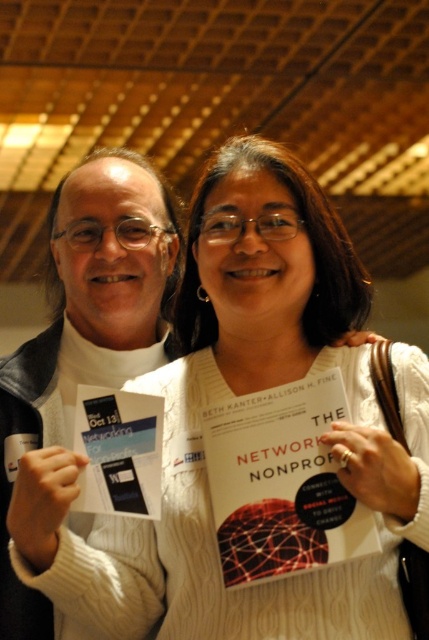
Question: Which point appears farthest from the camera in this image?

Choices:
 (A) (247, 540)
 (B) (154, 413)

Answer: (B)

Question: Does white sweater at left appear on the right side of white paper book at center?

Choices:
 (A) no
 (B) yes

Answer: (A)

Question: Among these points, which one is farthest from the camera?

Choices:
 (A) (102, 406)
 (B) (68, 253)
 (C) (337, 506)

Answer: (B)

Question: Can you confirm if white sweater at left is positioned to the right of white paper book at center?

Choices:
 (A) no
 (B) yes

Answer: (A)

Question: Which point is closer to the camera?

Choices:
 (A) 87,401
 (B) 88,259

Answer: (A)

Question: Does white sweater at left have a smaller size compared to white paper book at center?

Choices:
 (A) no
 (B) yes

Answer: (A)